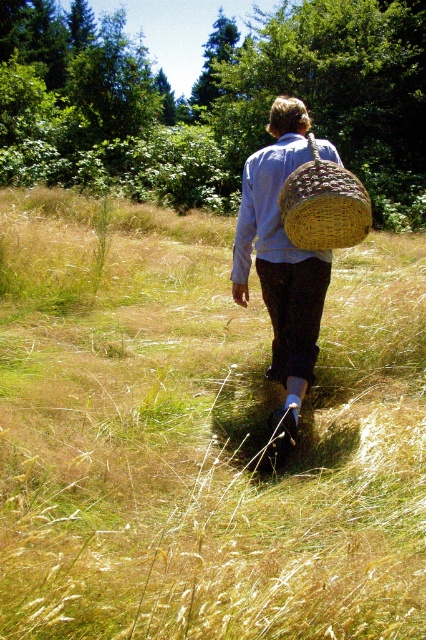
You are a photographer trying to capture the person in the image. You notice the light blue woven shirt at center and the woven straw basket at upper center. Which object is closer to your camera lens?

The light blue woven shirt at center is closer to the camera lens because it is further to the viewer than the woven straw basket at upper center.

You are a photographer aiming to capture a closeup of the woven straw basket at center. Given that your camera can focus on objects within 3 meters, will you need to move closer to the subject?

The woven straw basket at center is 4.13 meters away from the camera, which is beyond the 3 meter focus range. You will need to move closer to the subject to capture a clear closeup.

You are a photographer trying to capture the woven straw basket at center in your shot. The camera is set to focus on the point at coordinates 0.5, 0.5. Will the basket be in focus?

The woven straw basket at center is located at coordinates (282,257), which is slightly to the left and below the camera focus point at (213,320). Therefore, it may not be in focus.